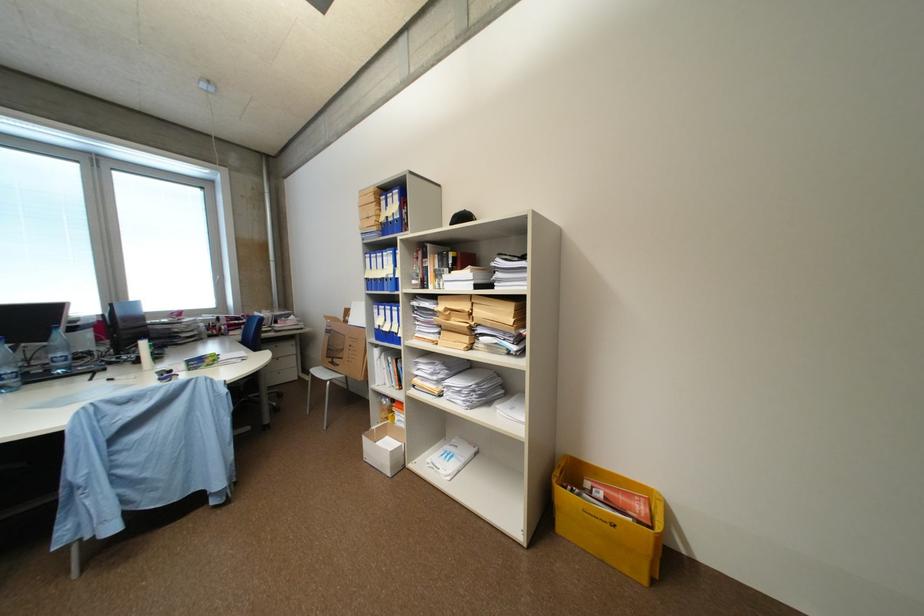
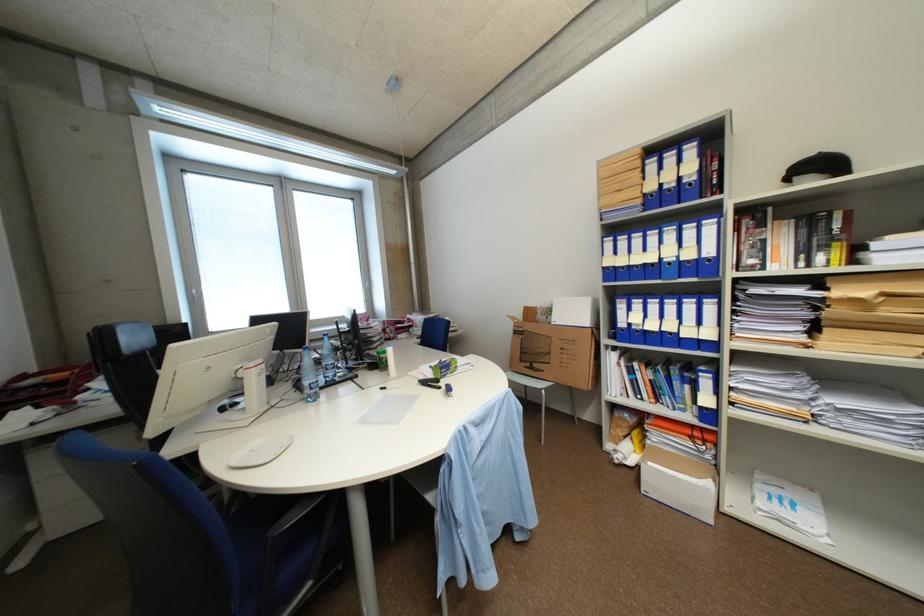
Question: What movement of the cameraman would produce the second image?

Choices:
 (A) Left
 (B) Right
 (C) Forward
 (D) Backward

Answer: (A)